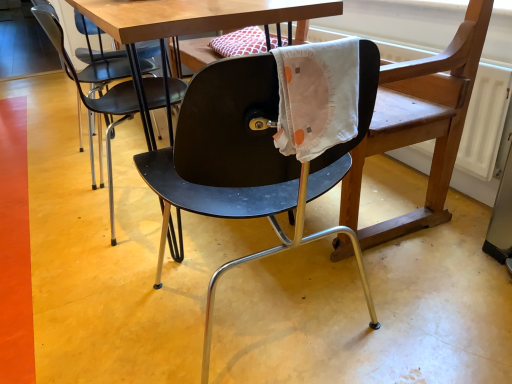
Question: Would you say matte black chair at center, acting as the second chair starting from the right, contains matte black chair at center, the second chair viewed from the left?

Choices:
 (A) yes
 (B) no

Answer: (B)

Question: Is matte black chair at center, which appears as the 1th chair when viewed from the left, positioned with its back to matte black chair at center, the second chair viewed from the left?

Choices:
 (A) no
 (B) yes

Answer: (A)

Question: Is matte black chair at center, acting as the second chair starting from the right, to the left of matte black chair at center, marked as the 1th chair in a right-to-left arrangement, from the viewer's perspective?

Choices:
 (A) yes
 (B) no

Answer: (A)

Question: Is matte black chair at center, which appears as the 1th chair when viewed from the left, closer to camera compared to matte black chair at center, marked as the 1th chair in a right-to-left arrangement?

Choices:
 (A) yes
 (B) no

Answer: (B)

Question: Is matte black chair at center, acting as the second chair starting from the right, oriented towards matte black chair at center, marked as the 1th chair in a right-to-left arrangement?

Choices:
 (A) no
 (B) yes

Answer: (A)

Question: From the image's perspective, relative to matte black chair at center, which appears as the 1th chair when viewed from the left, is matte black chair at center, the second chair viewed from the left, above or below?

Choices:
 (A) above
 (B) below

Answer: (B)

Question: Which is correct: matte black chair at center, the second chair viewed from the left, is inside matte black chair at center, acting as the second chair starting from the right, or outside of it?

Choices:
 (A) inside
 (B) outside

Answer: (B)

Question: In the image, is matte black chair at center, marked as the 1th chair in a right-to-left arrangement, on the left side or the right side of matte black chair at center, which appears as the 1th chair when viewed from the left?

Choices:
 (A) left
 (B) right

Answer: (B)

Question: From a real-world perspective, relative to matte black chair at center, which appears as the 1th chair when viewed from the left, is matte black chair at center, marked as the 1th chair in a right-to-left arrangement, vertically above or below?

Choices:
 (A) below
 (B) above

Answer: (B)

Question: Considering their positions, is matte black chair at center, acting as the second chair starting from the right, located in front of or behind matte black chair at center, the second chair viewed from the left?

Choices:
 (A) behind
 (B) front

Answer: (A)

Question: From their relative heights in the image, would you say matte black chair at center, acting as the second chair starting from the right, is taller or shorter than matte black chair at center, the second chair viewed from the left?

Choices:
 (A) tall
 (B) short

Answer: (B)

Question: Is matte black chair at center, which appears as the 1th chair when viewed from the left, inside or outside of matte black chair at center, the second chair viewed from the left?

Choices:
 (A) inside
 (B) outside

Answer: (B)

Question: Considering the positions of matte black chair at center, acting as the second chair starting from the right, and matte black chair at center, the second chair viewed from the left, in the image, is matte black chair at center, acting as the second chair starting from the right, wider or thinner than matte black chair at center, the second chair viewed from the left,?

Choices:
 (A) thin
 (B) wide

Answer: (A)

Question: Is matte black chair at center, which appears as the 1th chair when viewed from the left, spatially inside matte black swivel chair at center, or outside of it?

Choices:
 (A) inside
 (B) outside

Answer: (B)

Question: Relative to matte black swivel chair at center, is matte black chair at center, acting as the second chair starting from the right, in front or behind?

Choices:
 (A) behind
 (B) front

Answer: (A)